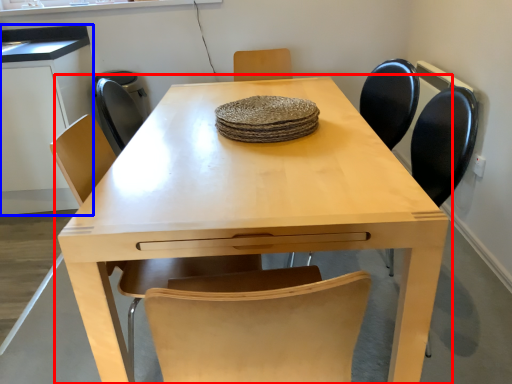
Question: Among these objects, which one is nearest to the camera, table (highlighted by a red box) or computer desk (highlighted by a blue box)?

Choices:
 (A) table
 (B) computer desk

Answer: (A)